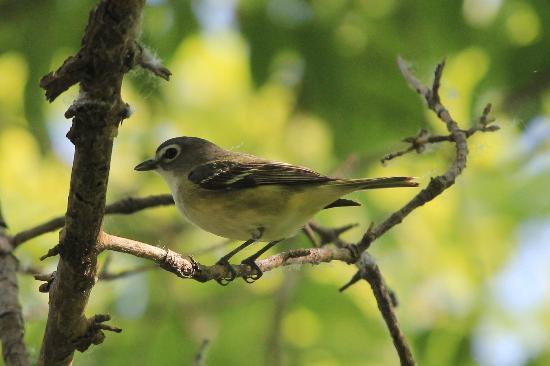
This screenshot has height=366, width=550. Find the location of `the chest`. the chest is located at coordinates (190, 210).